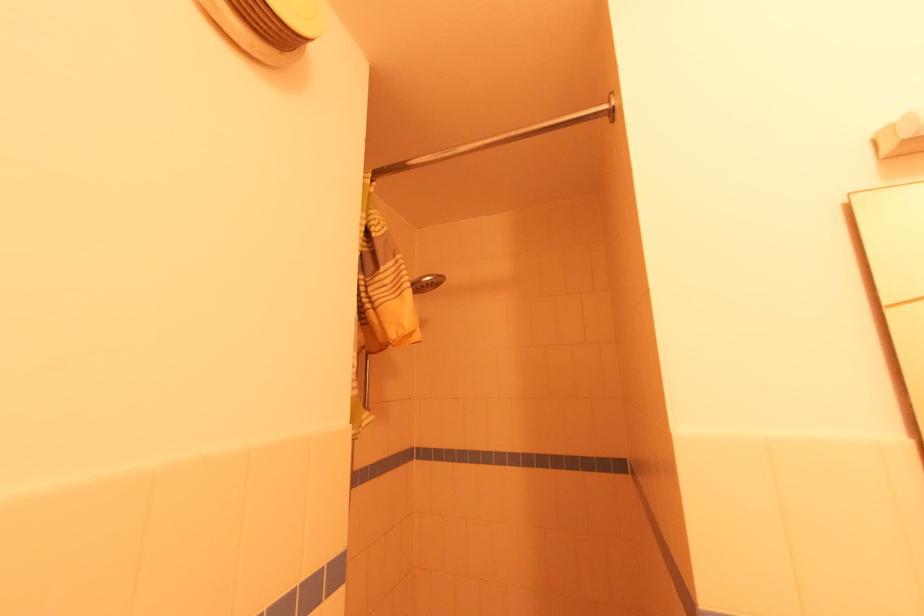
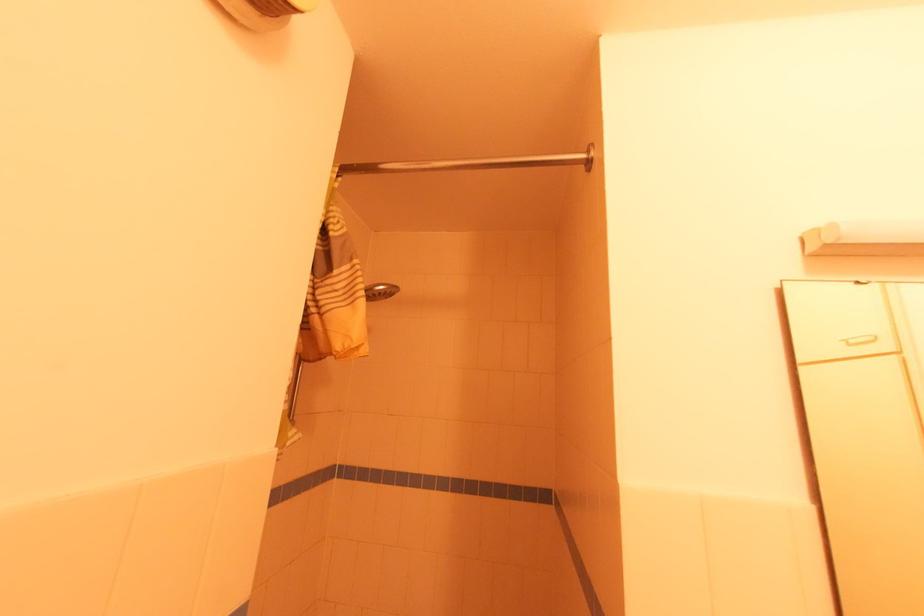
In the second image, find the point that corresponds to [430,278] in the first image.

(383, 288)